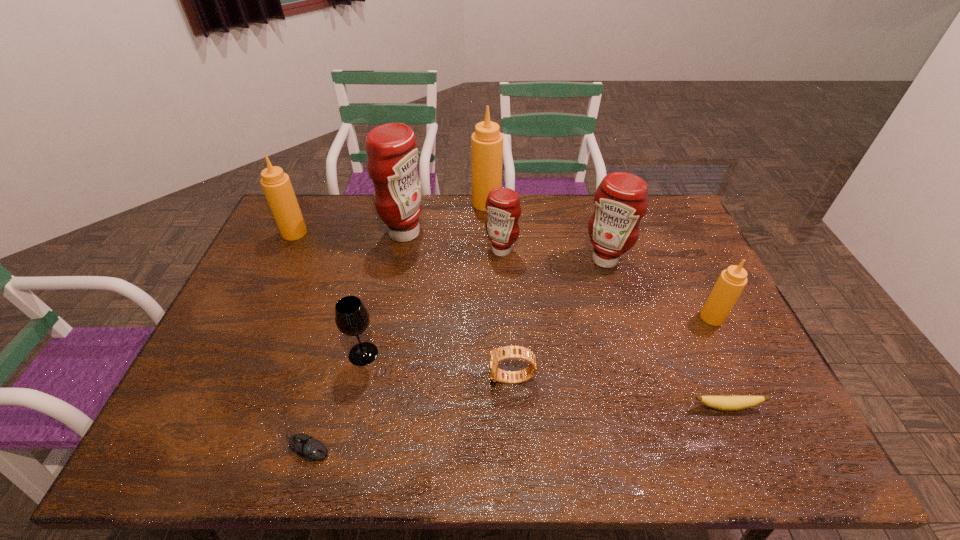
The image size is (960, 540). Identify the location of object that is at the near edge. (305, 446).

At what (x,y) coordinates should I click in order to perform the action: click on object situated at the left edge. Please return your answer as a coordinate pair (x, y). The image size is (960, 540). Looking at the image, I should click on (277, 187).

Find the location of a particular element. This screenshot has width=960, height=540. condiment that is at the right edge is located at coordinates (731, 282).

Image resolution: width=960 pixels, height=540 pixels. Find the location of `banana that is at the right edge`. banana that is at the right edge is located at coordinates (726, 403).

This screenshot has width=960, height=540. What are the coordinates of `object that is at the far left corner` in the screenshot? It's located at (277, 187).

This screenshot has width=960, height=540. What are the coordinates of `free point at the far edge` in the screenshot? It's located at (579, 195).

The height and width of the screenshot is (540, 960). In order to click on vacant position at the near edge of the desktop in this screenshot , I will do `click(541, 458)`.

Identify the location of vacant space at the left edge. Image resolution: width=960 pixels, height=540 pixels. (257, 276).

You are a GUI agent. You are given a task and a screenshot of the screen. Output one action in this format:
    pyautogui.click(x=<x>, y=<y>)
    Task: Click on the vacant space at the right edge of the desktop
    
    Given the screenshot: What is the action you would take?
    pyautogui.click(x=705, y=334)

In the image, there is a desktop. Identify the location of vacant space at the far right corner. The width and height of the screenshot is (960, 540). (659, 198).